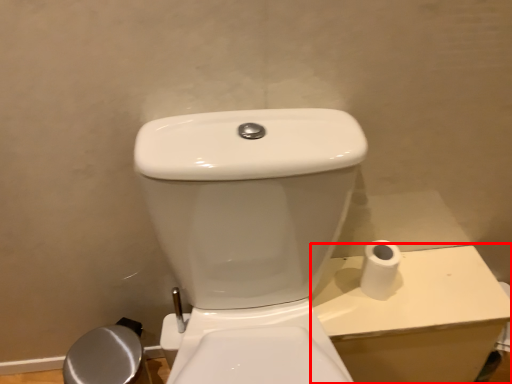
Question: Where is porcelain (annotated by the red box) located in relation to toilet paper in the image?

Choices:
 (A) left
 (B) right

Answer: (B)